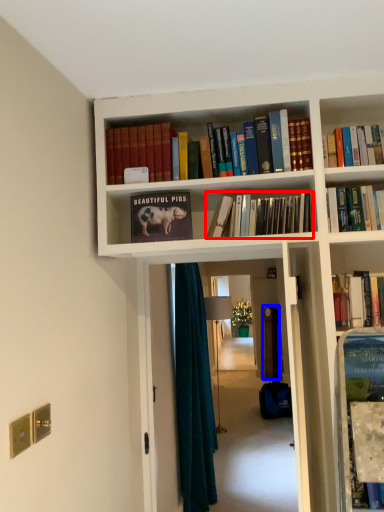
Question: Which object appears closest to the camera in this image, book (highlighted by a red box) or door (highlighted by a blue box)?

Choices:
 (A) book
 (B) door

Answer: (A)